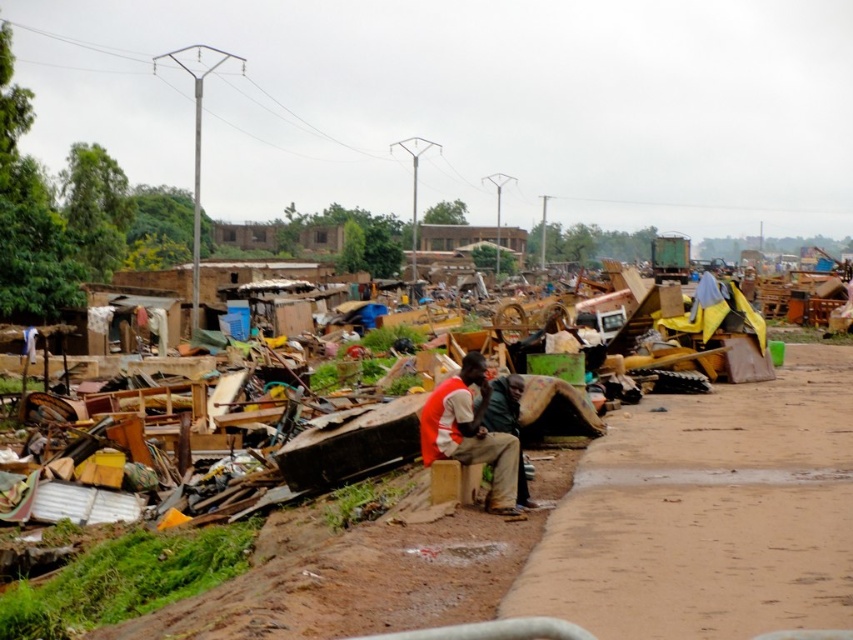
Question: Among these points, which one is nearest to the camera?

Choices:
 (A) click(x=485, y=378)
 (B) click(x=524, y=474)

Answer: (A)

Question: Is orange fabric shirt at center to the left of green fabric jacket at center from the viewer's perspective?

Choices:
 (A) yes
 (B) no

Answer: (A)

Question: Observing the image, what is the correct spatial positioning of brown dirt pavement at lower right in reference to green fabric jacket at center?

Choices:
 (A) right
 (B) left

Answer: (A)

Question: Based on their relative distances, which object is nearer to the green fabric jacket at center?

Choices:
 (A) brown dirt pavement at lower right
 (B) orange fabric shirt at center

Answer: (B)

Question: Can you confirm if brown dirt pavement at lower right is wider than green fabric jacket at center?

Choices:
 (A) yes
 (B) no

Answer: (A)

Question: Which of these objects is positioned farthest from the orange fabric shirt at center?

Choices:
 (A) brown dirt pavement at lower right
 (B) green fabric jacket at center

Answer: (A)